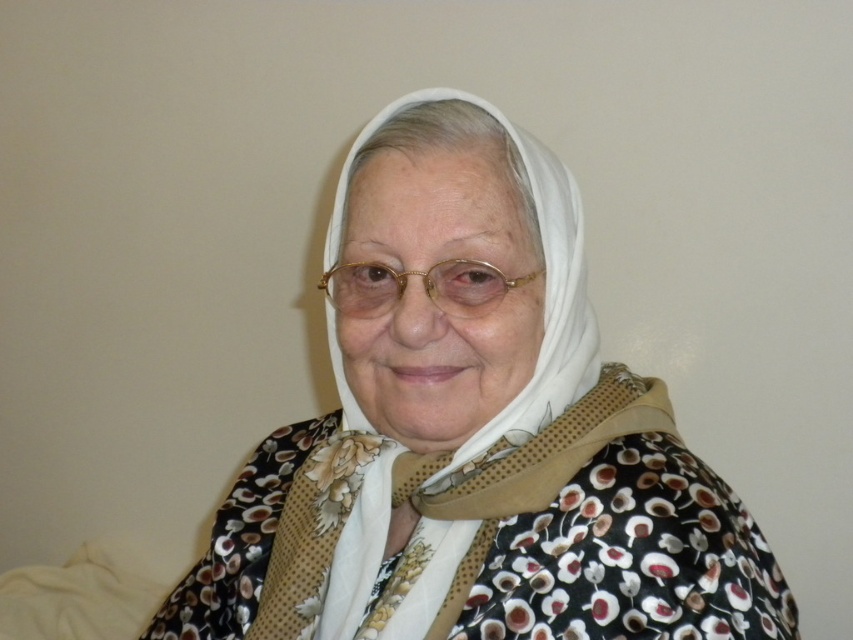
Question: Which point is closer to the camera taking this photo?

Choices:
 (A) (347, 285)
 (B) (770, 602)

Answer: (B)

Question: Does white fabric headscarf at center have a larger size compared to gold metallic glasses at center?

Choices:
 (A) yes
 (B) no

Answer: (A)

Question: Does white fabric headscarf at center appear on the right side of gold metallic glasses at center?

Choices:
 (A) yes
 (B) no

Answer: (A)

Question: Which of the following is the closest to the observer?

Choices:
 (A) (790, 627)
 (B) (366, 307)

Answer: (A)

Question: Does white fabric headscarf at center have a smaller size compared to gold metallic glasses at center?

Choices:
 (A) yes
 (B) no

Answer: (B)

Question: Which of the following is the farthest from the observer?

Choices:
 (A) (578, 348)
 (B) (380, 272)

Answer: (A)